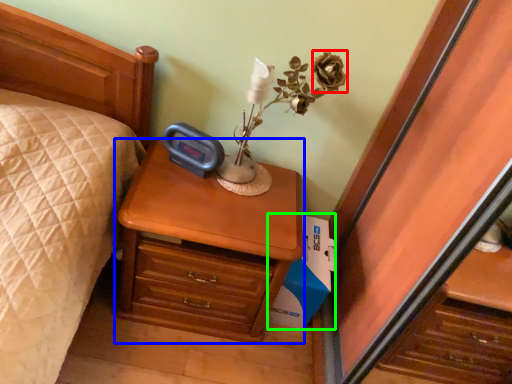
Question: Considering the real-world distances, which object is farthest from flower (highlighted by a red box)? nightstand (highlighted by a blue box) or cardboard box (highlighted by a green box)?

Choices:
 (A) nightstand
 (B) cardboard box

Answer: (B)